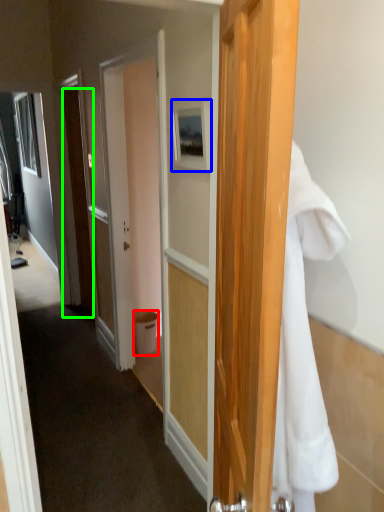
Question: Which is nearer to the trash bin/can (highlighted by a red box)? picture frame (highlighted by a blue box) or door (highlighted by a green box).

Choices:
 (A) picture frame
 (B) door

Answer: (B)